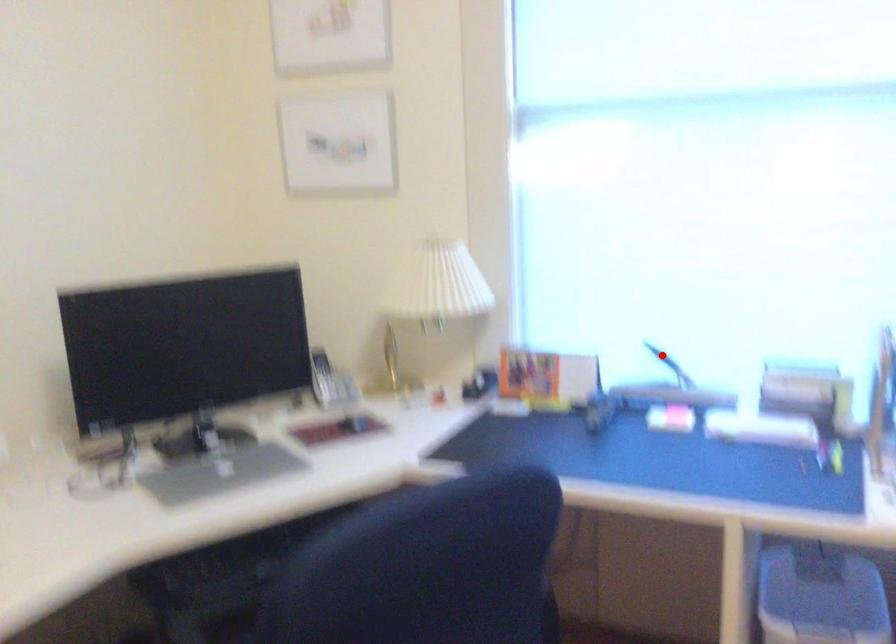
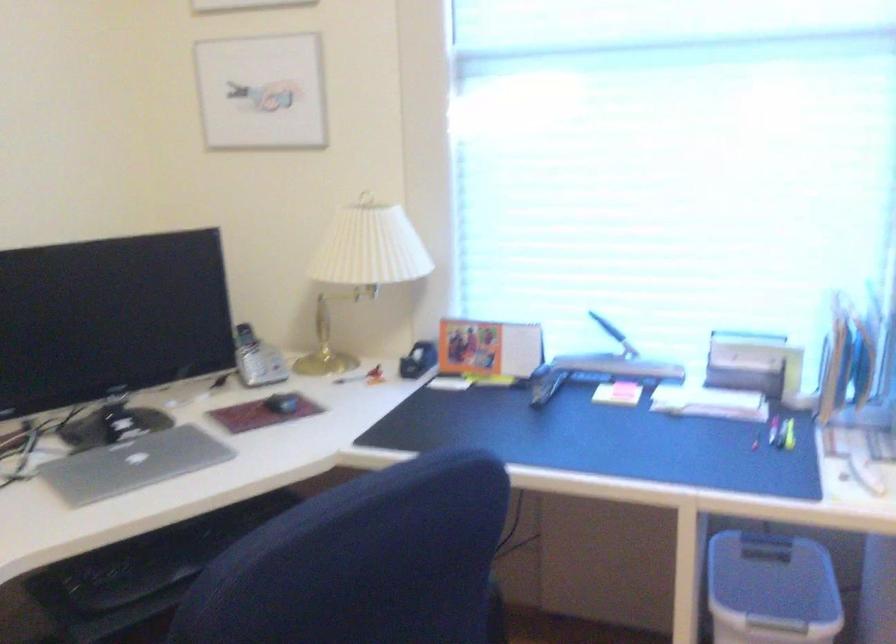
The point at the highlighted location is marked in the first image. Where is the corresponding point in the second image?

(607, 327)